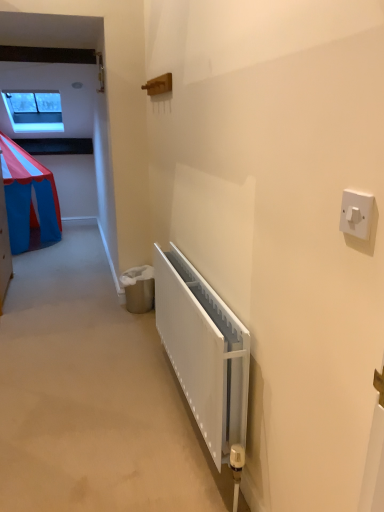
Question: Considering the relative positions of white plastic light switch at upper right and transparent glass window at upper left in the image provided, is white plastic light switch at upper right to the left of transparent glass window at upper left from the viewer's perspective?

Choices:
 (A) no
 (B) yes

Answer: (A)

Question: From the image's perspective, does white plastic light switch at upper right appear higher than transparent glass window at upper left?

Choices:
 (A) no
 (B) yes

Answer: (A)

Question: Does white plastic light switch at upper right have a lesser height compared to transparent glass window at upper left?

Choices:
 (A) no
 (B) yes

Answer: (B)

Question: Can you confirm if white plastic light switch at upper right is positioned to the right of transparent glass window at upper left?

Choices:
 (A) no
 (B) yes

Answer: (B)

Question: Is white plastic light switch at upper right positioned with its back to transparent glass window at upper left?

Choices:
 (A) yes
 (B) no

Answer: (B)

Question: Does white plastic light switch at upper right have a larger size compared to transparent glass window at upper left?

Choices:
 (A) yes
 (B) no

Answer: (B)

Question: Is white matte radiator at lower center closer to camera compared to transparent glass window at upper left?

Choices:
 (A) yes
 (B) no

Answer: (A)

Question: From the image's perspective, does white matte radiator at lower center appear lower than transparent glass window at upper left?

Choices:
 (A) yes
 (B) no

Answer: (A)

Question: Is white matte radiator at lower center thinner than transparent glass window at upper left?

Choices:
 (A) yes
 (B) no

Answer: (A)

Question: Is white matte radiator at lower center beside transparent glass window at upper left?

Choices:
 (A) no
 (B) yes

Answer: (A)

Question: Are white matte radiator at lower center and transparent glass window at upper left located far from each other?

Choices:
 (A) yes
 (B) no

Answer: (A)

Question: Is transparent glass window at upper left completely or partially inside white matte radiator at lower center?

Choices:
 (A) yes
 (B) no

Answer: (B)

Question: Is white matte radiator at lower center wider than white plastic light switch at upper right?

Choices:
 (A) no
 (B) yes

Answer: (B)